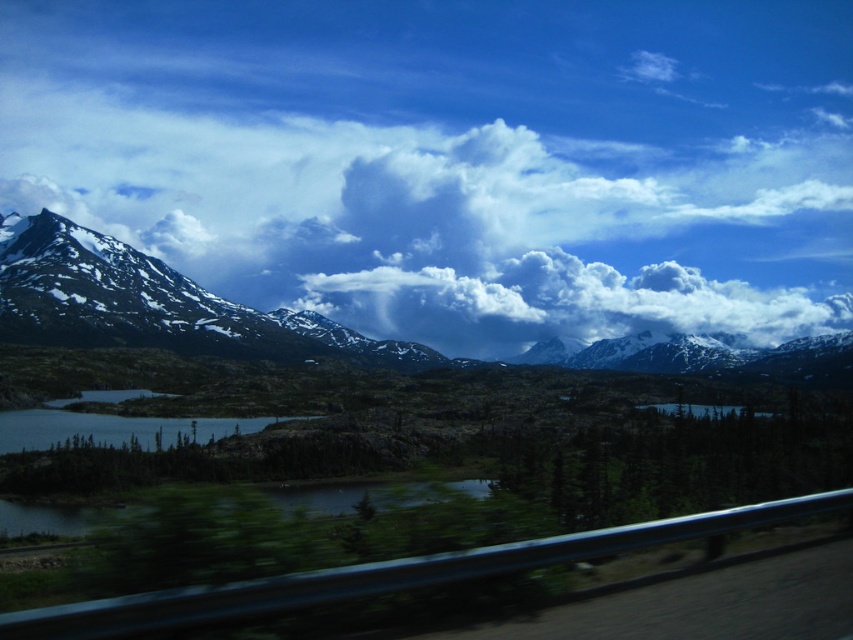
Question: Where is white fluffy cloud at upper center located in relation to white fluffy cloud at center in the image?

Choices:
 (A) below
 (B) above

Answer: (B)

Question: Estimate the real-world distances between objects in this image. Which object is farther from the white fluffy cloud at upper center?

Choices:
 (A) transparent glass car window at lower center
 (B) white fluffy cloud at center

Answer: (A)

Question: Can you confirm if white fluffy cloud at upper center is positioned to the right of transparent glass car window at lower center?

Choices:
 (A) yes
 (B) no

Answer: (B)

Question: Which point is farther from the camera taking this photo?

Choices:
 (A) (463, 307)
 (B) (170, 611)
 (C) (161, 282)

Answer: (A)

Question: Is the position of white fluffy cloud at center more distant than that of transparent glass car window at lower center?

Choices:
 (A) no
 (B) yes

Answer: (B)

Question: Which is nearer to the transparent glass car window at lower center?

Choices:
 (A) snowy rock mountain range at upper left
 (B) white fluffy cloud at upper center
 (C) white fluffy cloud at center

Answer: (A)